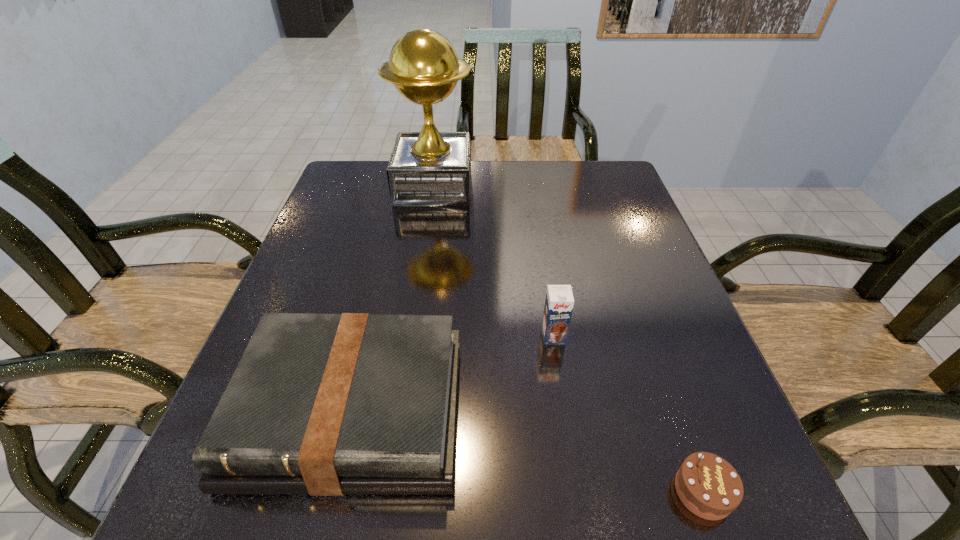
This screenshot has width=960, height=540. I want to click on object that is at the far edge, so click(x=429, y=168).

Where is `hardback book positioned at the near edge`? hardback book positioned at the near edge is located at coordinates (355, 403).

The width and height of the screenshot is (960, 540). I want to click on chocolate cake that is positioned at the near edge, so click(x=707, y=485).

Find the location of a particular element. object positioned at the left edge is located at coordinates (355, 403).

You are a GUI agent. You are given a task and a screenshot of the screen. Output one action in this format:
    pyautogui.click(x=<x>, y=<y>)
    Task: Click on the object that is at the right edge
    
    Given the screenshot: What is the action you would take?
    pyautogui.click(x=707, y=485)

This screenshot has width=960, height=540. What are the coordinates of `object situated at the near left corner` in the screenshot? It's located at (355, 403).

At what (x,y) coordinates should I click in order to perform the action: click on object at the near right corner. Please return your answer as a coordinate pair (x, y). Image resolution: width=960 pixels, height=540 pixels. Looking at the image, I should click on (707, 485).

You are a GUI agent. You are given a task and a screenshot of the screen. Output one action in this format:
    pyautogui.click(x=<x>, y=<y>)
    Task: Click on the vacant space at the far edge of the desktop
    
    Given the screenshot: What is the action you would take?
    pyautogui.click(x=525, y=188)

At what (x,y) coordinates should I click in order to perform the action: click on free location at the near edge of the desktop. Please return your answer as a coordinate pair (x, y). Looking at the image, I should click on (508, 487).

In the image, there is a desktop. Identify the location of free region at the left edge. The image size is (960, 540). (300, 307).